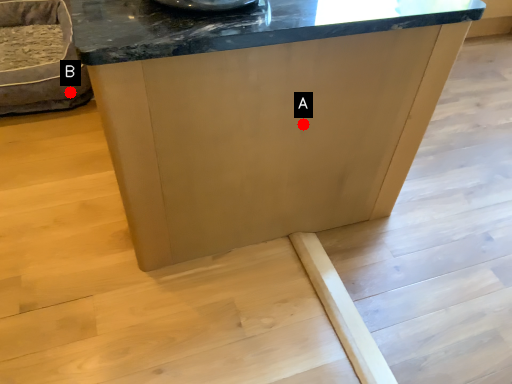
Question: Two points are circled on the image, labeled by A and B beside each circle. Which of the following is the farthest from the observer?

Choices:
 (A) A is further
 (B) B is further

Answer: (B)